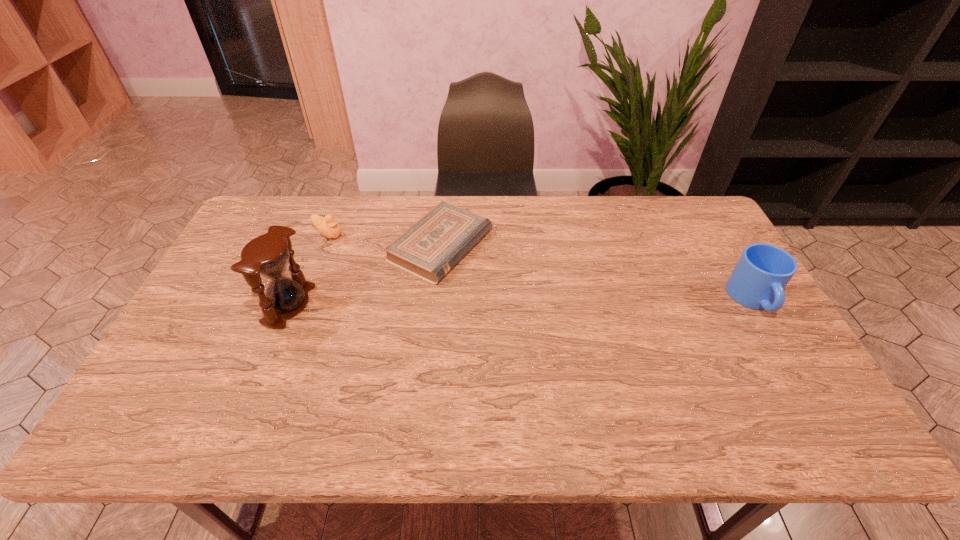
You are a GUI agent. You are given a task and a screenshot of the screen. Output one action in this format:
    pyautogui.click(x=<x>, y=<y>)
    Task: Click on the vacant region located on the spine side of the second object from right to left
    Image resolution: width=960 pixels, height=540 pixels.
    Given the screenshot: What is the action you would take?
    pyautogui.click(x=572, y=305)

I want to click on vacant space situated on the face of the second shortest object, so click(x=391, y=267).

In order to click on vacant space located on the face of the second shortest object in this screenshot , I will do `click(352, 246)`.

In order to click on vacant space located 0.260m on the face of the second shortest object in this screenshot , I will do `click(398, 271)`.

You are a GUI agent. You are given a task and a screenshot of the screen. Output one action in this format:
    pyautogui.click(x=<x>, y=<y>)
    Task: Click on the Bible present at the far edge
    The image size is (960, 540).
    Given the screenshot: What is the action you would take?
    pyautogui.click(x=429, y=249)

Where is `duckling that is at the far edge`? duckling that is at the far edge is located at coordinates (327, 226).

Image resolution: width=960 pixels, height=540 pixels. I want to click on object present at the right edge, so click(x=761, y=274).

Where is `vacant space at the far edge of the desktop`? The height and width of the screenshot is (540, 960). vacant space at the far edge of the desktop is located at coordinates (606, 202).

This screenshot has width=960, height=540. Identify the location of free space at the near edge. (326, 401).

Find the location of `free region at the left edge`. free region at the left edge is located at coordinates (204, 346).